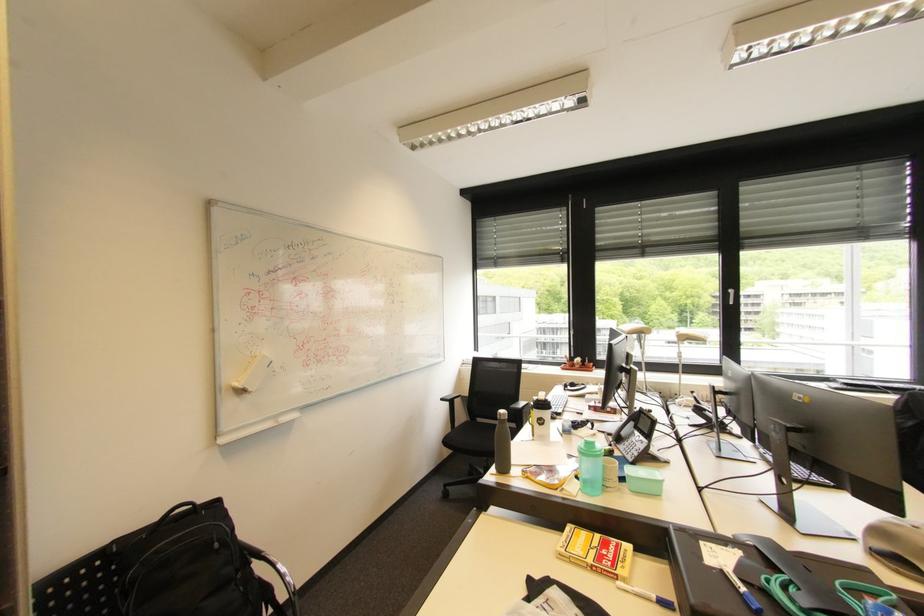
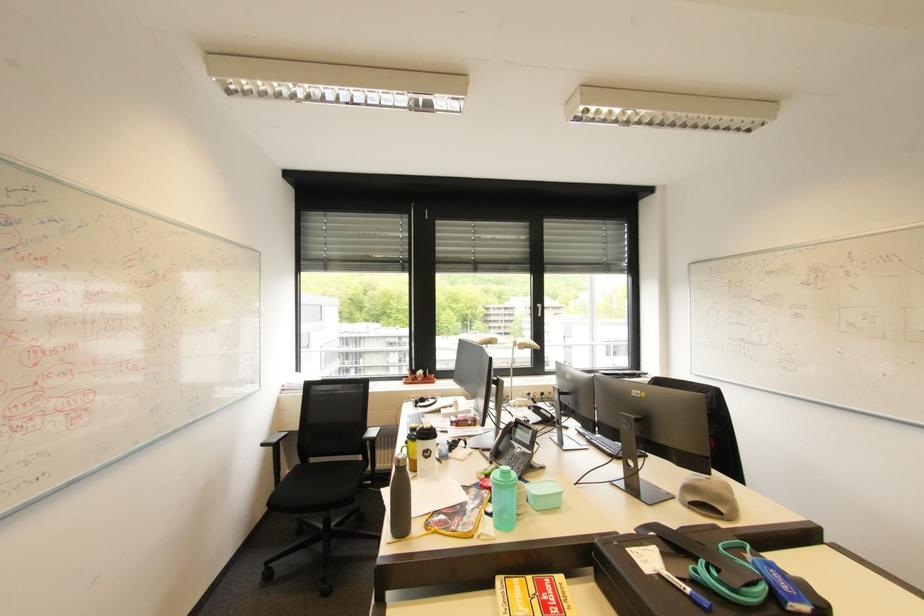
The point at (505, 415) is marked in the first image. Where is the corresponding point in the second image?

(405, 461)